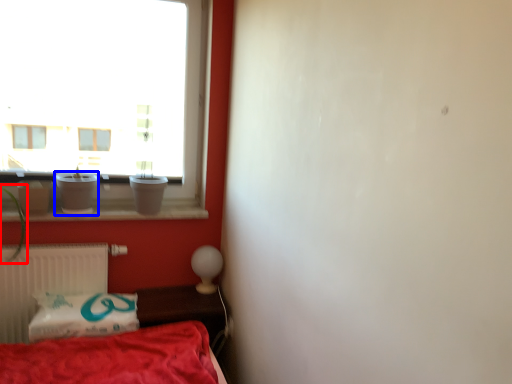
Question: Which object appears closest to the camera in this image, plant (highlighted by a red box) or glass vase (highlighted by a blue box)?

Choices:
 (A) plant
 (B) glass vase

Answer: (A)